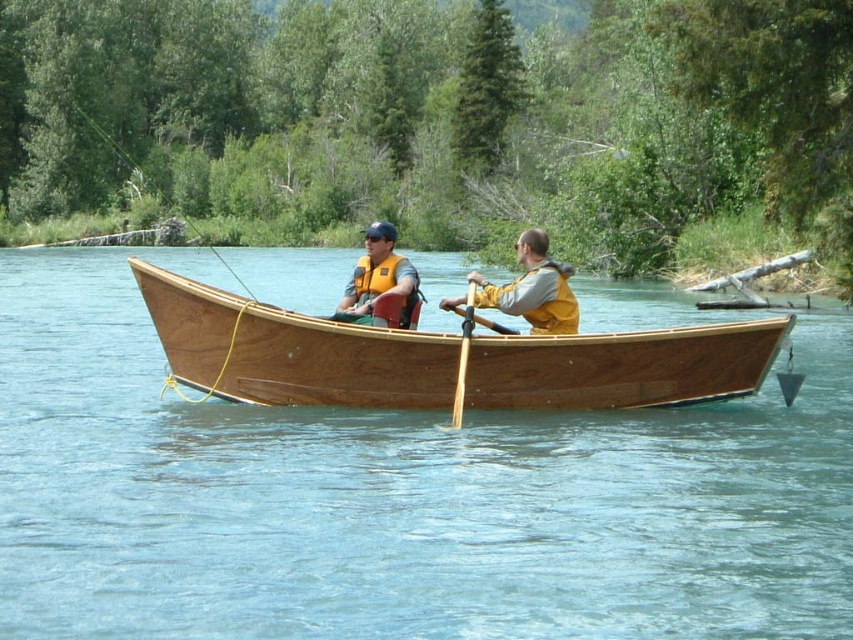
You are standing on the dock and looking at the boat. There is a point marked at coordinates (x=379, y=278). Which object is this point located on?

The point at coordinates (x=379, y=278) is located on the matte yellow life vest at center.

You are standing on the shore and looking at the wooden boat with two people. There are two points marked on the boat. Which point is closer to you, point (376, 280) or point (465, 326)?

Point (376, 280) is closer to you because it is further to the viewer than point (465, 326).